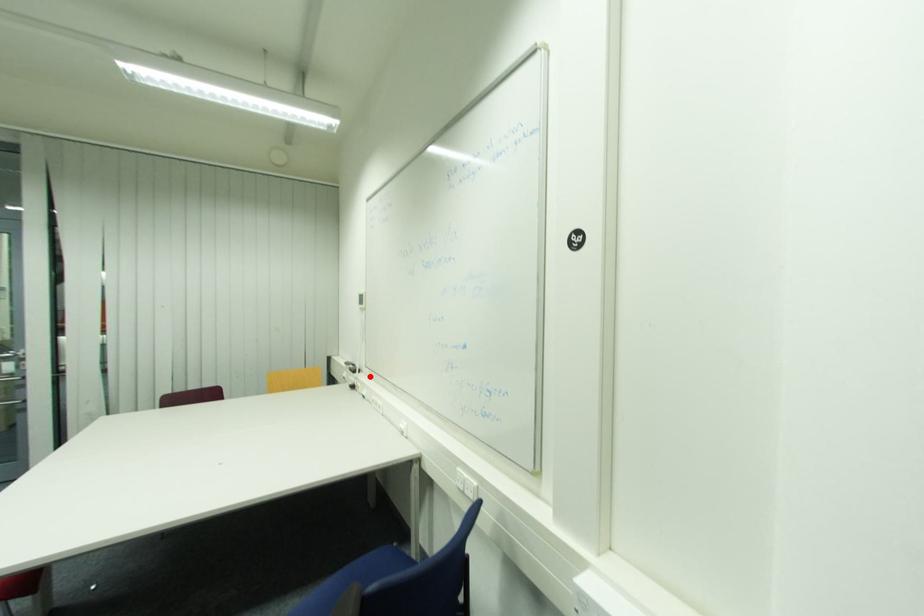
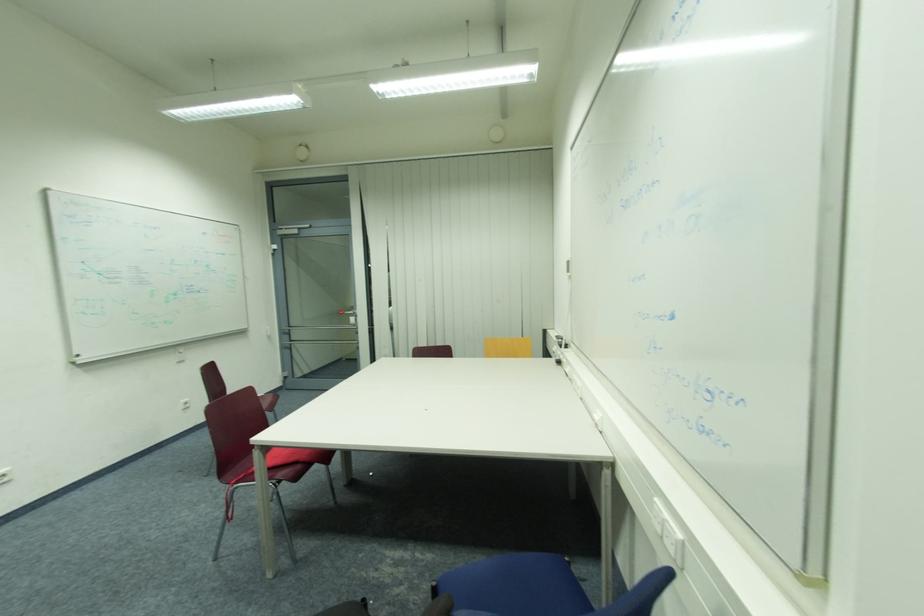
In the second image, find the point that corresponds to the highlighted location in the first image.

(578, 352)